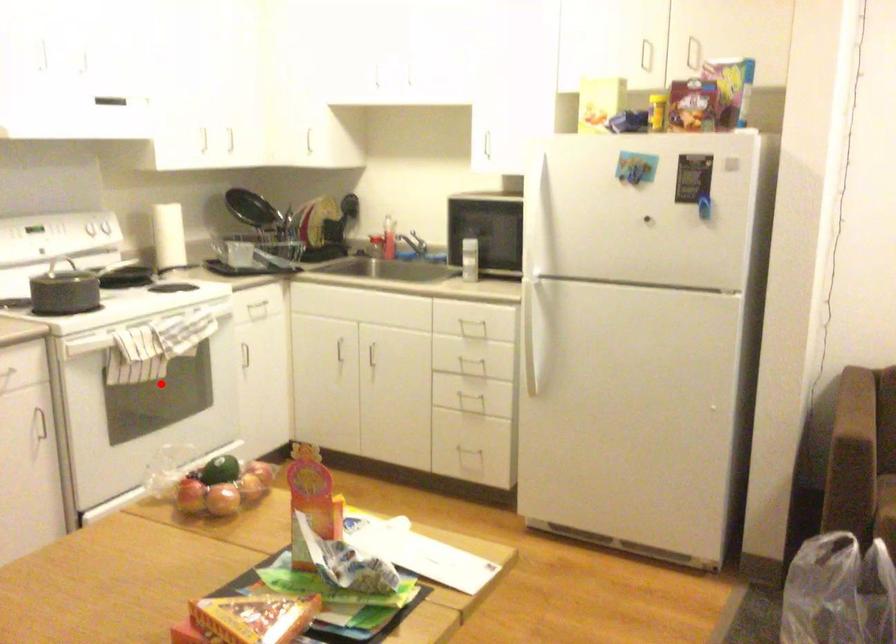
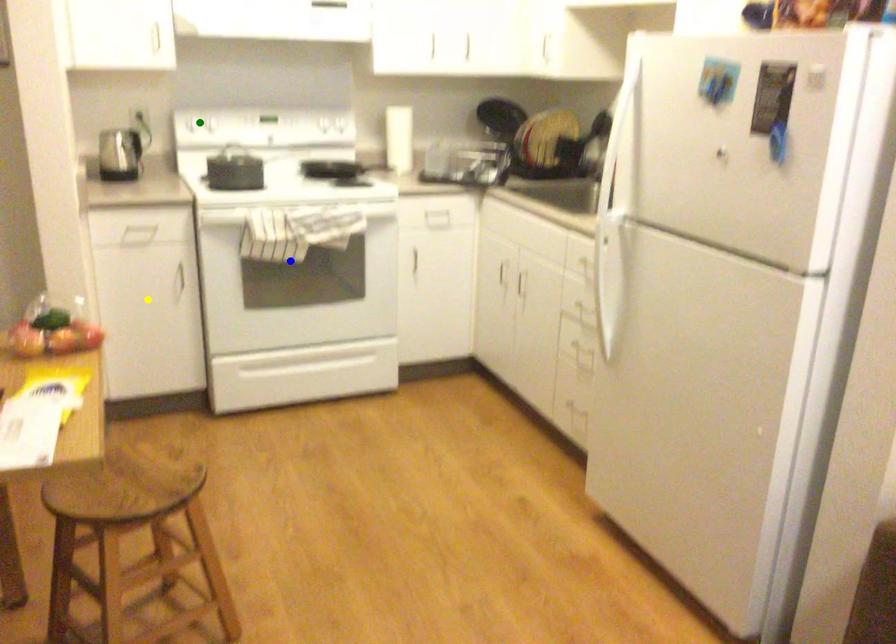
Question: I am providing you with two images of the same scene from different viewpoints. A red point is marked on the first image. You are given multiple points on the second image. Which point in image 2 is actually the same real-world point as the red point in image 1?

Choices:
 (A) yellow point
 (B) green point
 (C) blue point

Answer: (C)